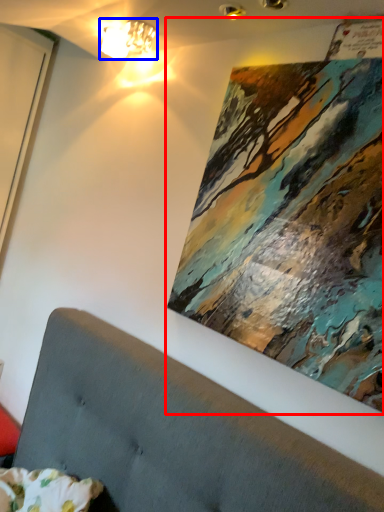
Question: Which of the following is the closest to the observer, picture frame (highlighted by a red box) or lamp (highlighted by a blue box)?

Choices:
 (A) picture frame
 (B) lamp

Answer: (A)